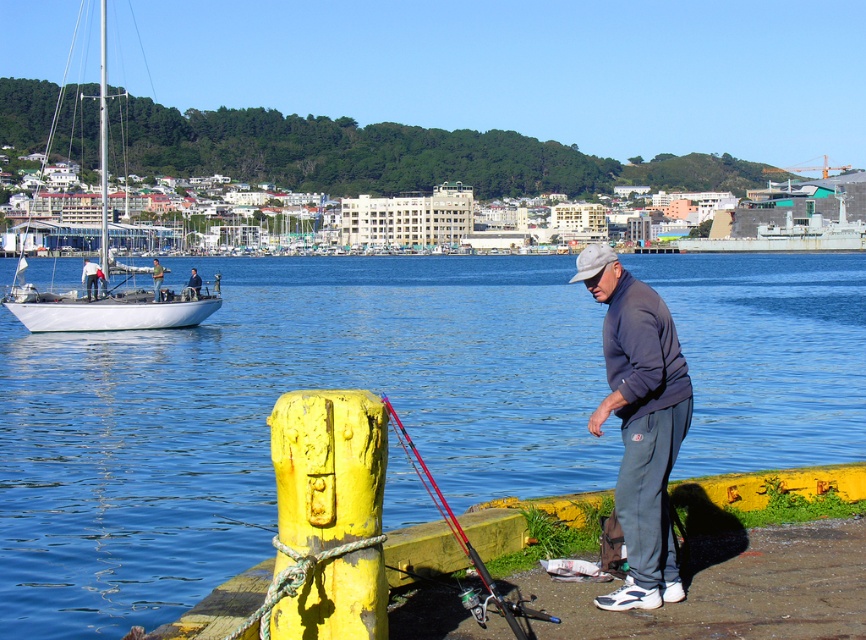
You are standing on the dock and looking at two points marked in the scene. Which point is closer to you, point (95, 273) or point (197, 288)?

Point (95, 273) is closer to the viewer than point (197, 288).

You are a photographer trying to capture a clear shot of the red fiberglass fishing pole at lower center and the matte gray jacket at lower right. Since you want both objects to be in focus, you need to know which one is taller. Which object is taller?

The red fiberglass fishing pole at lower center is taller than the matte gray jacket at lower right according to the description.

In the scene shown: You are a photographer planning to take a wide shot of the waterfront scene. You want to ensure both the blue water at center and the gray fleece jacket at lower right are clearly visible. Which object should you focus on first to ensure proper exposure, considering their sizes?

The blue water at center is bigger than the gray fleece jacket at lower right, so you should focus on the blue water at center first to ensure proper exposure, as larger objects often require more attention in exposure settings.